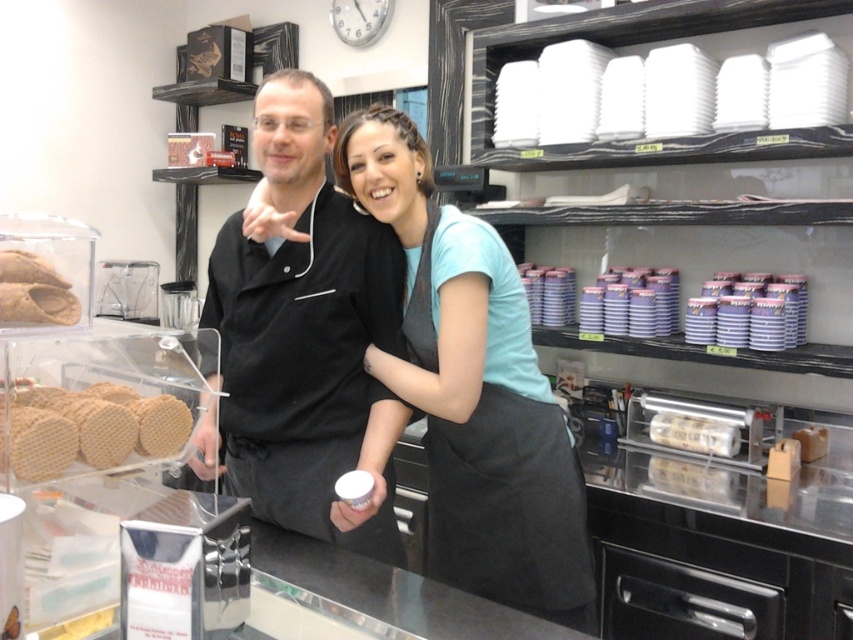
Question: Which of the following is the farthest from the observer?

Choices:
 (A) (207, 454)
 (B) (677, 486)

Answer: (B)

Question: Which point is closer to the camera?

Choices:
 (A) (28, 476)
 (B) (480, 547)

Answer: (A)

Question: Does golden wafer at left appear on the right side of translucent plastic bag at center?

Choices:
 (A) yes
 (B) no

Answer: (B)

Question: Does black matte shirt at center have a larger size compared to brown matte bread at center?

Choices:
 (A) no
 (B) yes

Answer: (B)

Question: Is light blue fabric apron at center below translucent plastic bag at center?

Choices:
 (A) yes
 (B) no

Answer: (B)

Question: Estimate the real-world distances between objects in this image. Which object is closer to the light blue fabric apron at center?

Choices:
 (A) translucent plastic bag at center
 (B) black matte shirt at center
 (C) brown matte bread at center
 (D) golden wafer at left

Answer: (B)